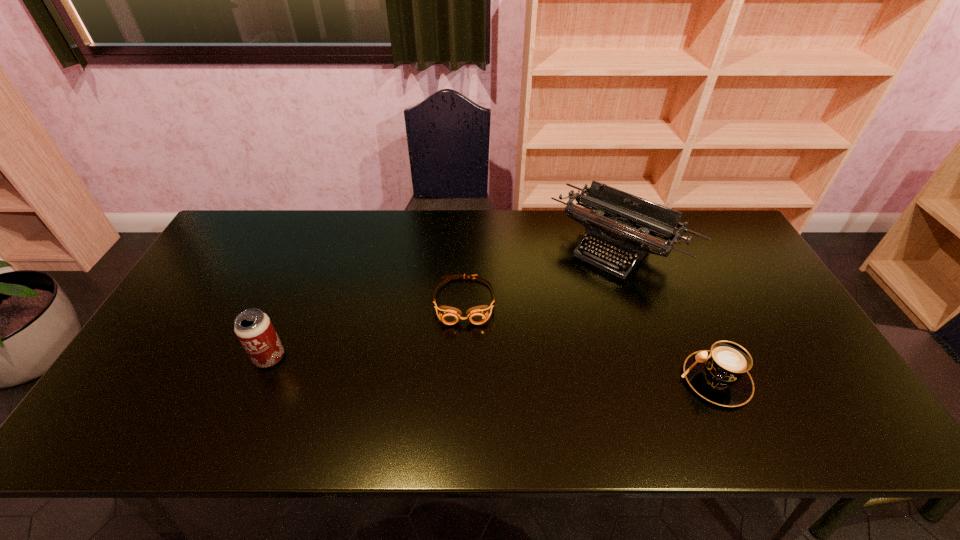
Locate an element on the screen. Image resolution: width=960 pixels, height=540 pixels. vacant area situated 0.060m with the lenses facing forward on the goggles is located at coordinates (464, 345).

Find the location of a particular element. This screenshot has width=960, height=540. blank area located with the lenses facing forward on the goggles is located at coordinates (464, 371).

The image size is (960, 540). I want to click on vacant space located with the lenses facing forward on the goggles, so click(x=464, y=357).

The width and height of the screenshot is (960, 540). I want to click on object that is at the far edge, so click(x=614, y=216).

Locate an element on the screen. The image size is (960, 540). object situated at the near edge is located at coordinates (720, 375).

Find the location of a particular element. The image size is (960, 540). free spot at the far edge of the desktop is located at coordinates 474,244.

In the image, there is a desktop. Identify the location of free space at the near edge. This screenshot has height=540, width=960. (224, 382).

Image resolution: width=960 pixels, height=540 pixels. In the image, there is a desktop. Identify the location of vacant space at the left edge. (193, 292).

What are the coordinates of `free location at the right edge` in the screenshot? It's located at (717, 265).

This screenshot has width=960, height=540. In order to click on free location at the far left corner in this screenshot , I will do `click(248, 245)`.